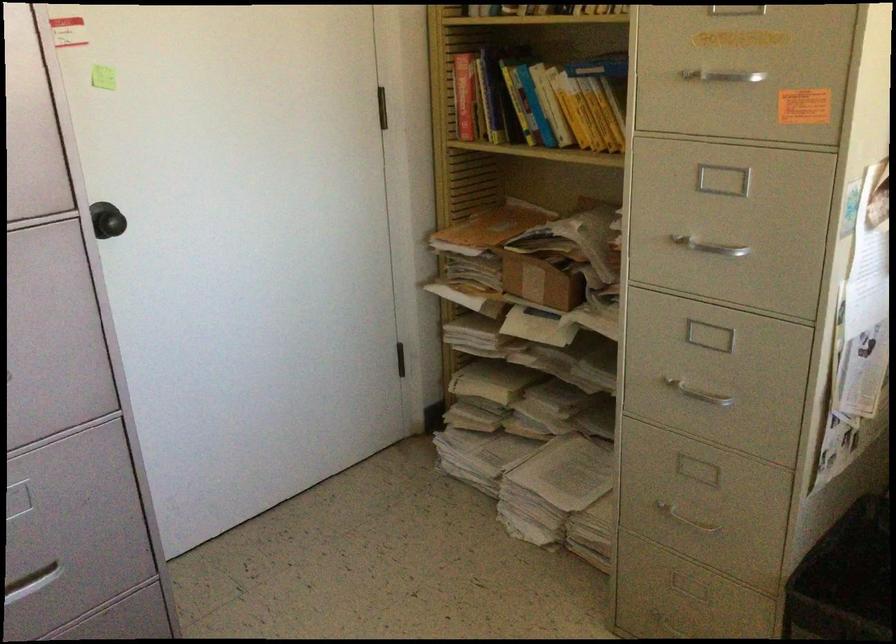
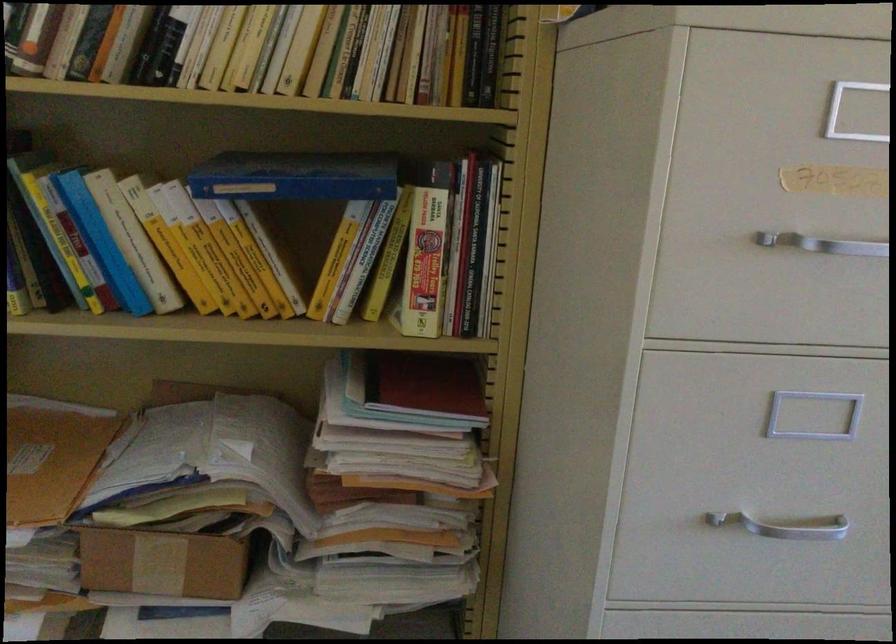
In the second image, find the point that corresponds to point 710,75 in the first image.

(823, 243)